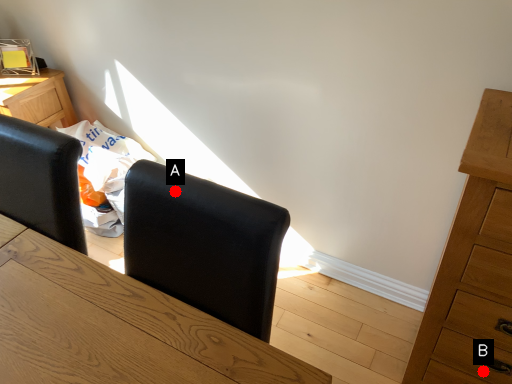
Question: Two points are circled on the image, labeled by A and B beside each circle. Which point is farther from the camera taking this photo?

Choices:
 (A) A is further
 (B) B is further

Answer: (B)